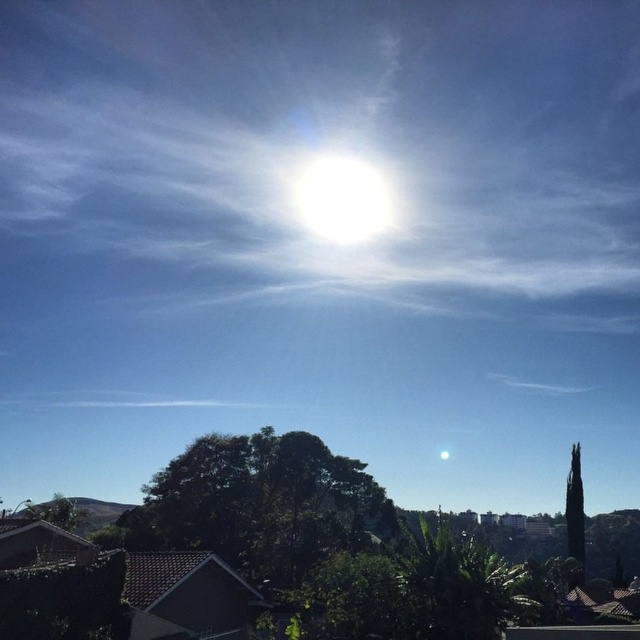
You are standing in the outdoor scene and want to take a photo of the green leafy tree at center. If your camera has a maximum focus range of 35 meters, will you be able to focus on the tree?

The green leafy tree at center is 36.78 meters away from camera, which exceeds the camera maximum focus range of 35 meters. Therefore, the camera cannot focus on the tree.

Looking at this image, you are standing at a point 100 feet away from the camera. You want to walk towards the point labeled as point (337, 493). Will you have to walk forward or backward to reach it?

The distance of point (337, 493) from camera is 177.27 feet. Since you are currently 100 feet away from the camera, you need to walk forward an additional 77.27 feet to reach the point (337, 493).

You are an astronomer observing the scene. You notice the green leafy tree at center and the white glossy sun at center. Which object appears closer to you in the image?

The green leafy tree at center appears closer to you than the white glossy sun at center because it is positioned in front of the sun in the scene.